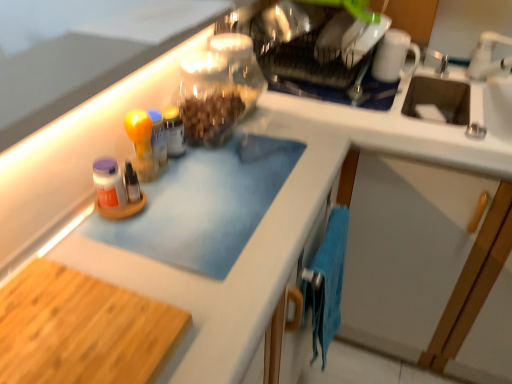
Locate an element on the screen. This screenshot has width=512, height=384. vacant area on top of clear glass jar at upper center (from a real-world perspective) is located at coordinates (311, 66).